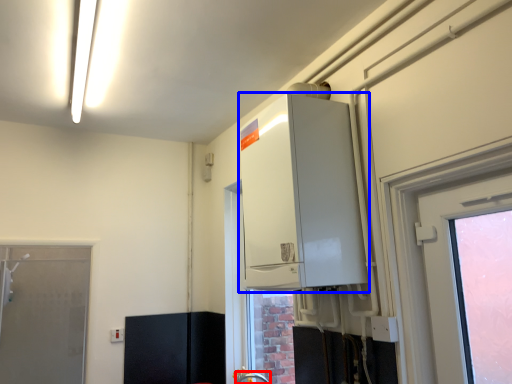
Question: Which of the following is the closest to the observer, faucet (highlighted by a red box) or appliance (highlighted by a blue box)?

Choices:
 (A) faucet
 (B) appliance

Answer: (B)